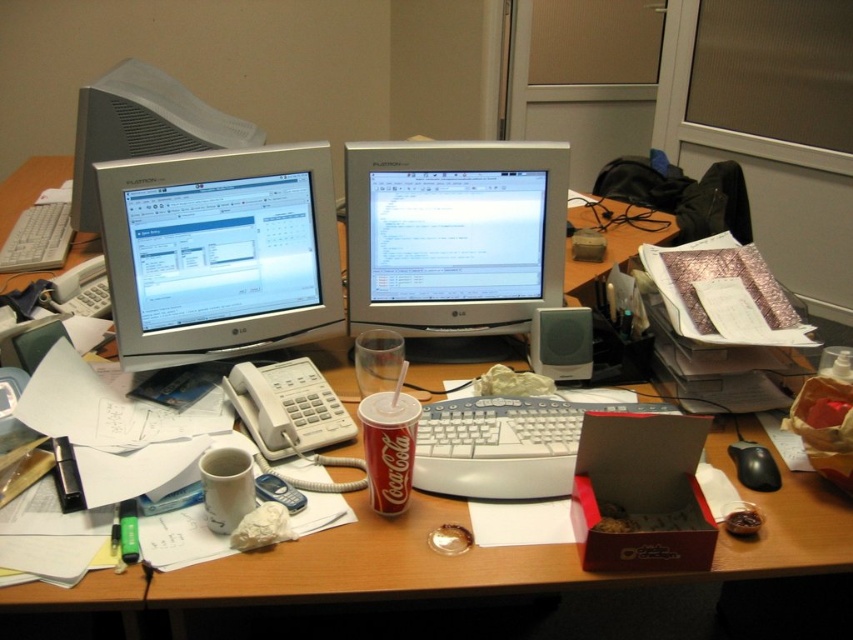
You are standing at the point marked by the coordinates point [387,448] on the desk. What object is located at this position?

The point [387,448] corresponds to the coca cola can at center.

You are organizing the desk and want to place a new monitor stand. The stand requires the monitor to be taller than 15 inches. Which monitor between the matte silver monitor at center left and the matte silver monitor at upper left should you choose?

The matte silver monitor at upper left is taller than the matte silver monitor at center left, so you should choose the matte silver monitor at upper left since it meets the height requirement for the stand.